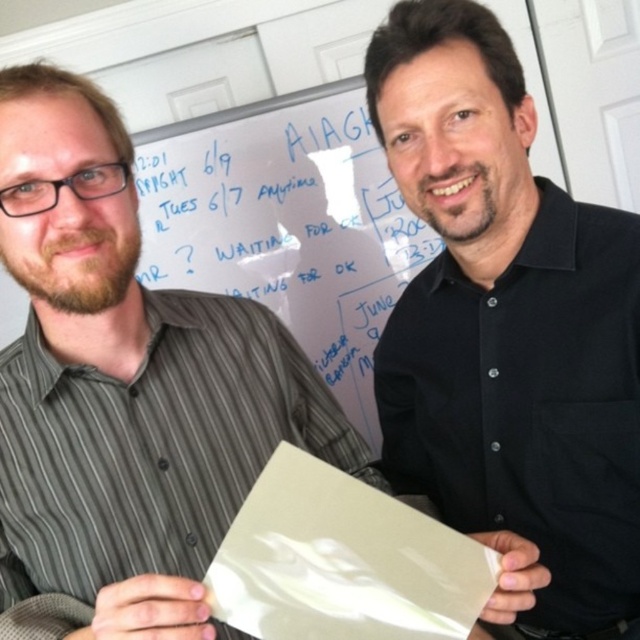
Can you confirm if black matte paper at center is taller than white glossy paper at center?

Correct, black matte paper at center is much taller as white glossy paper at center.

Can you confirm if black matte paper at center is positioned below white glossy paper at center?

No.

You are a GUI agent. You are given a task and a screenshot of the screen. Output one action in this format:
    pyautogui.click(x=<x>, y=<y>)
    Task: Click on the black matte paper at center
    The height and width of the screenshot is (640, 640).
    Given the screenshot: What is the action you would take?
    pyautogui.click(x=508, y=324)